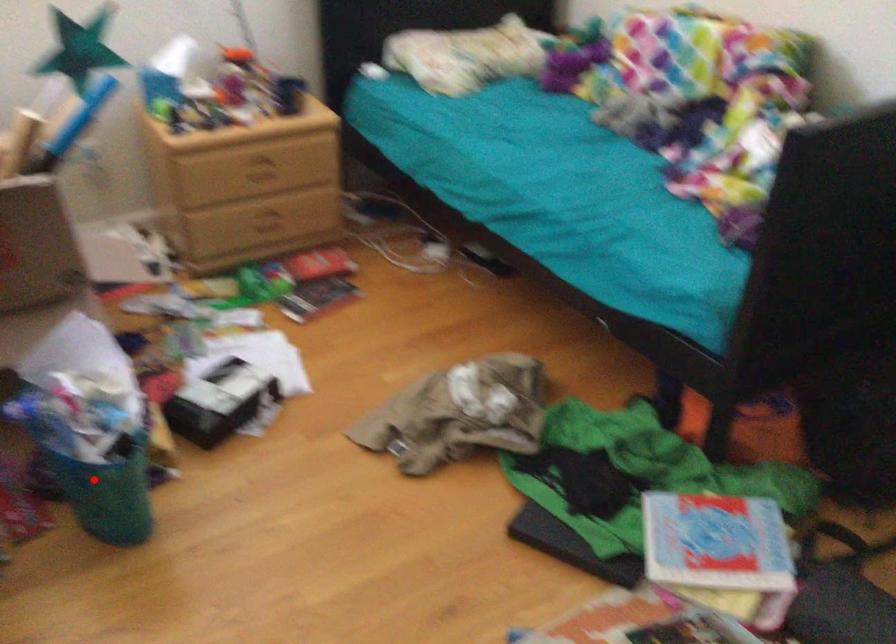
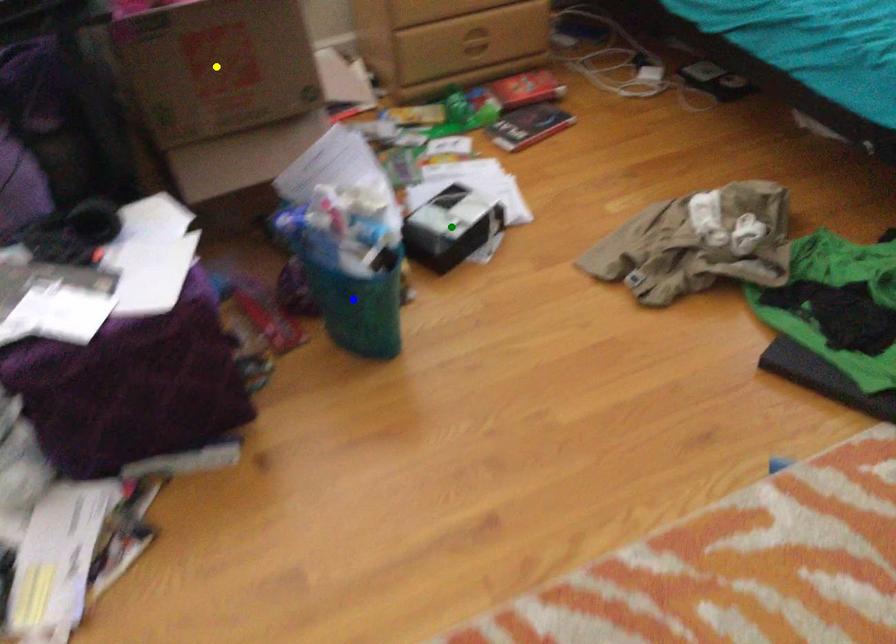
Question: I am providing you with two images of the same scene from different viewpoints. A red point is marked on the first image. You are given multiple points on the second image. In image 2, which mark is for the same physical point as the one in image 1?

Choices:
 (A) blue point
 (B) yellow point
 (C) green point

Answer: (A)